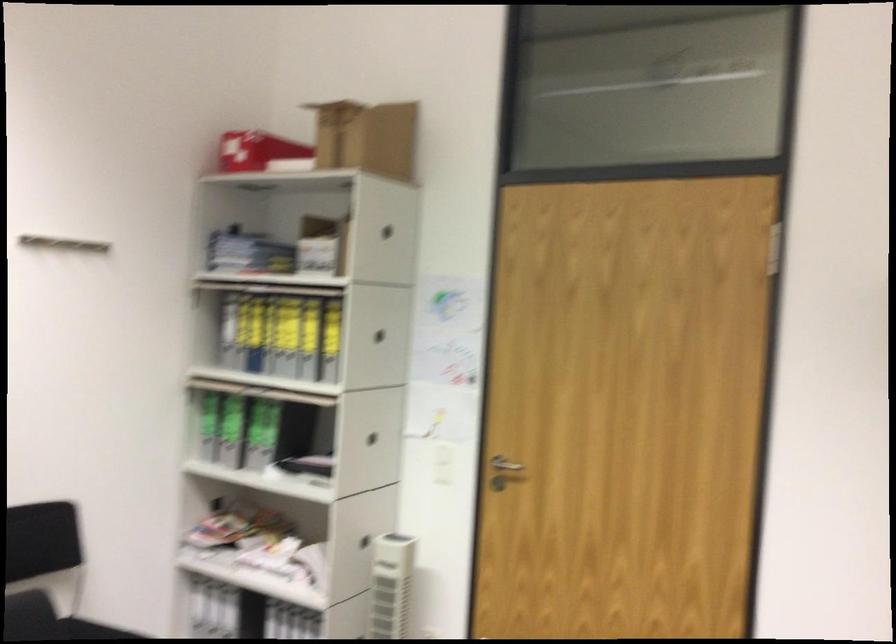
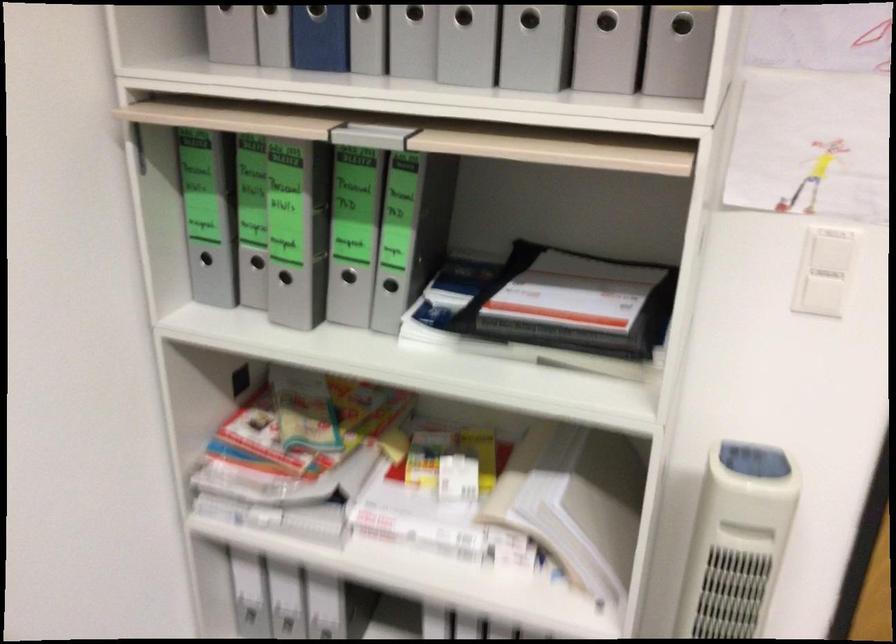
Find the pixel in the second image that matches pixel 341 355 in the first image.

(606, 21)